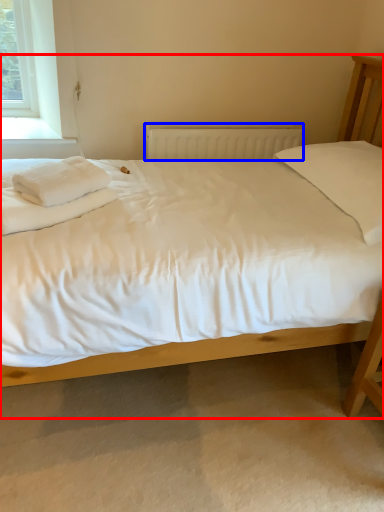
Question: Which object is further to the camera taking this photo, bed (highlighted by a red box) or radiator (highlighted by a blue box)?

Choices:
 (A) bed
 (B) radiator

Answer: (B)